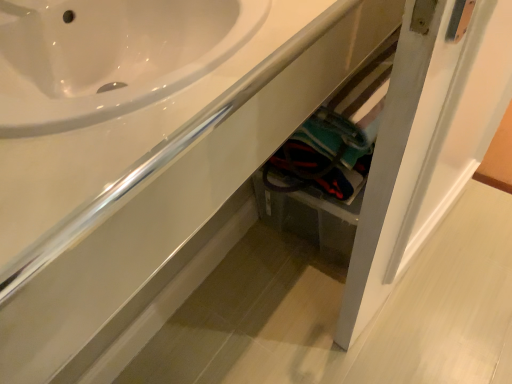
The height and width of the screenshot is (384, 512). I want to click on free space below white glossy sink at upper left (from a real-world perspective), so click(x=218, y=286).